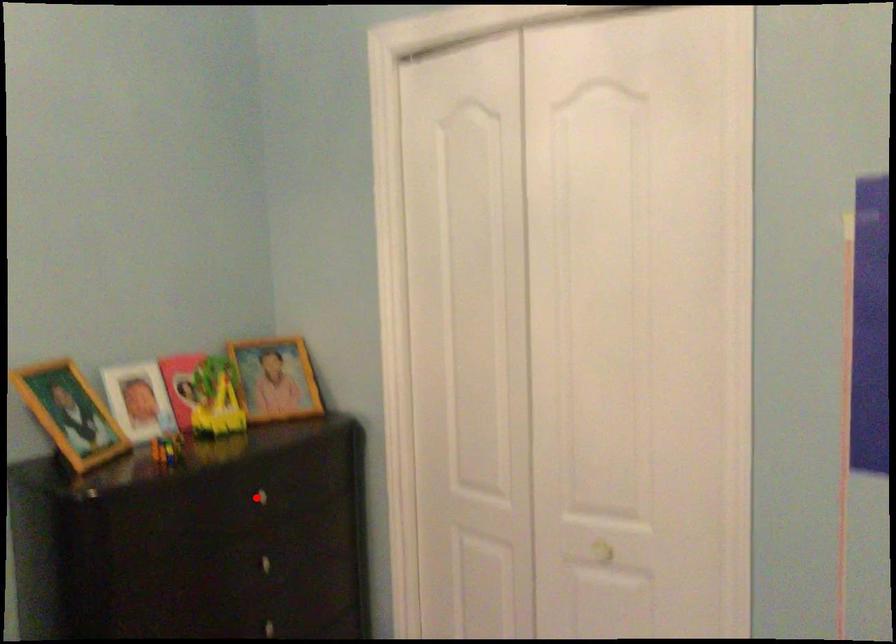
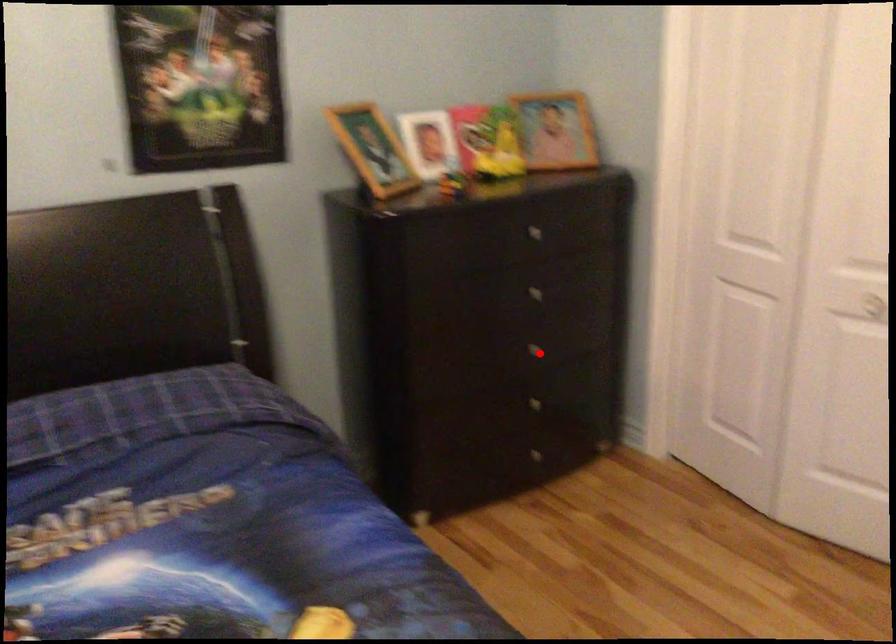
I am providing you with two images of the same scene from different viewpoints. A red point is marked on the first image and another point is marked on the second image. Is the marked point in image1 the same physical position as the marked point in image2?

No